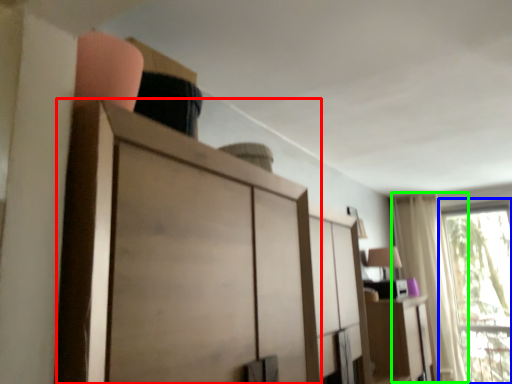
Question: Based on their relative distances, which object is farther from cupboard (highlighted by a red box)? Choose from window (highlighted by a blue box) and curtain (highlighted by a green box).

Choices:
 (A) window
 (B) curtain

Answer: (A)